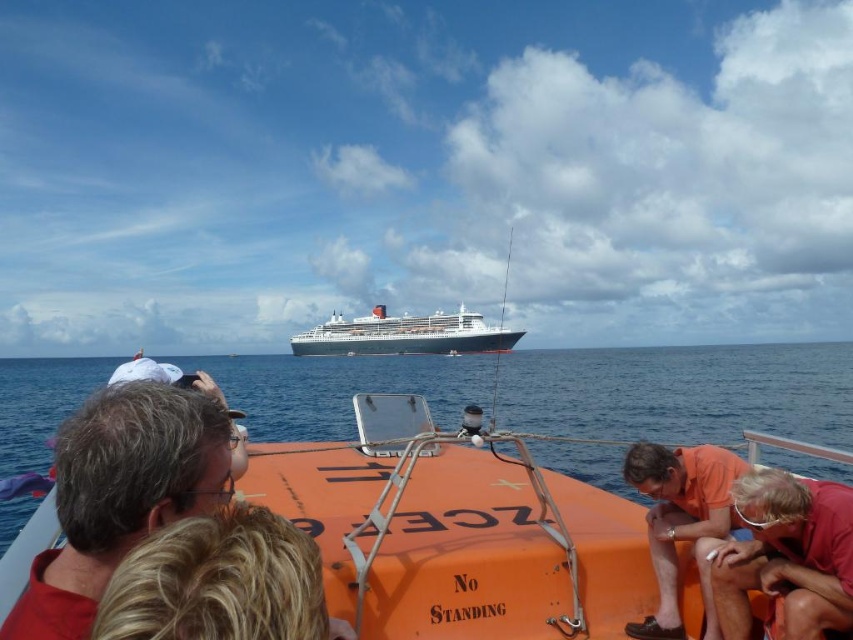
Question: Can you confirm if blonde hair at center is positioned above white glossy cruise ship at center?

Choices:
 (A) yes
 (B) no

Answer: (A)

Question: Which point is farther from the camera taking this photo?

Choices:
 (A) (822, 376)
 (B) (840, 508)
 (C) (323, 627)

Answer: (A)

Question: Among these points, which one is nearest to the camera?

Choices:
 (A) (410, 348)
 (B) (318, 365)
 (C) (782, 488)

Answer: (C)

Question: Does orange matte shirt at lower right have a larger size compared to white glossy cruise ship at center?

Choices:
 (A) no
 (B) yes

Answer: (A)

Question: Which point is farther to the camera?

Choices:
 (A) (453, 316)
 (B) (223, 406)
 (C) (264, 534)

Answer: (A)

Question: Where is blonde hair at center located in relation to white glossy cruise ship at center in the image?

Choices:
 (A) right
 (B) left

Answer: (A)